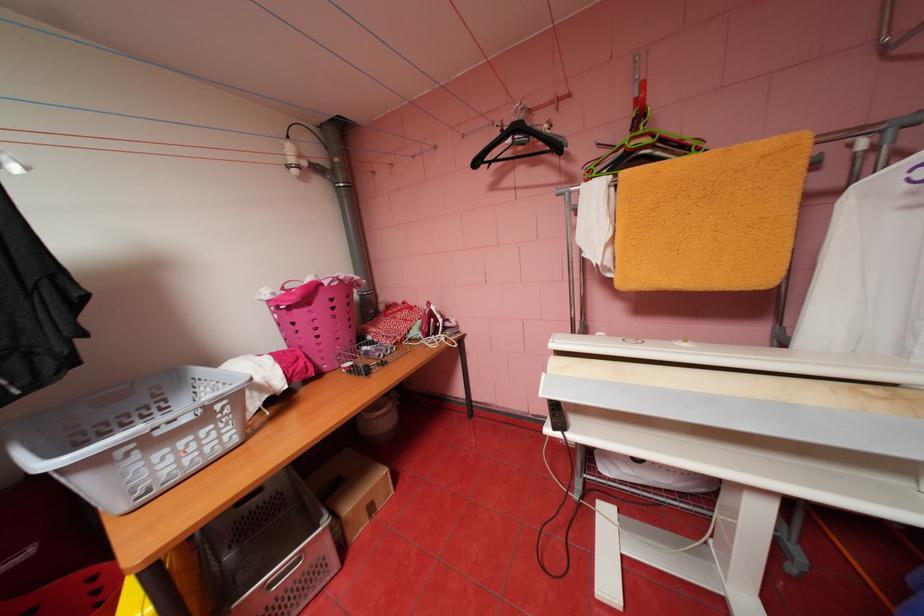
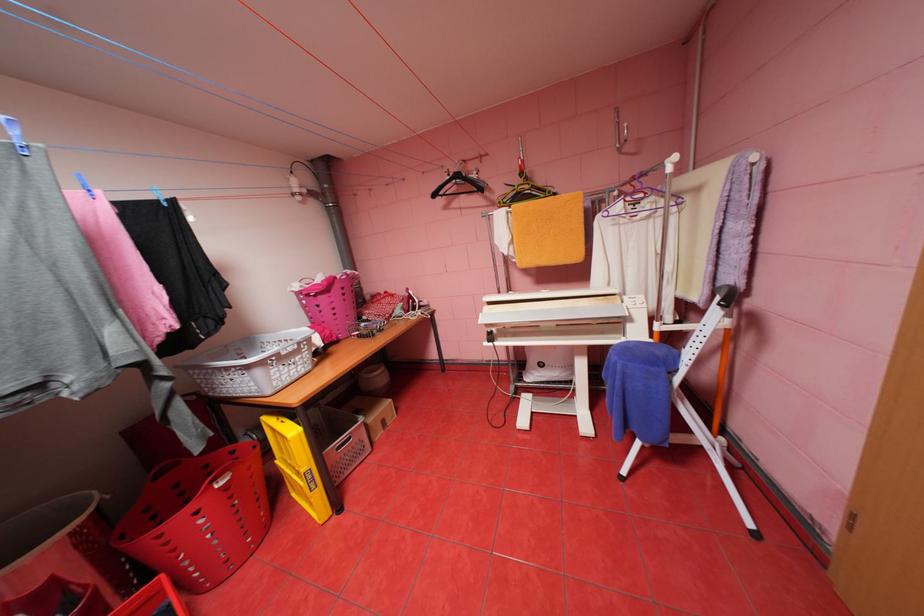
Question: The first image is from the beginning of the video and the second image is from the end. How did the camera likely rotate when shooting the video?

Choices:
 (A) Left
 (B) Right
 (C) Up
 (D) Down

Answer: (B)